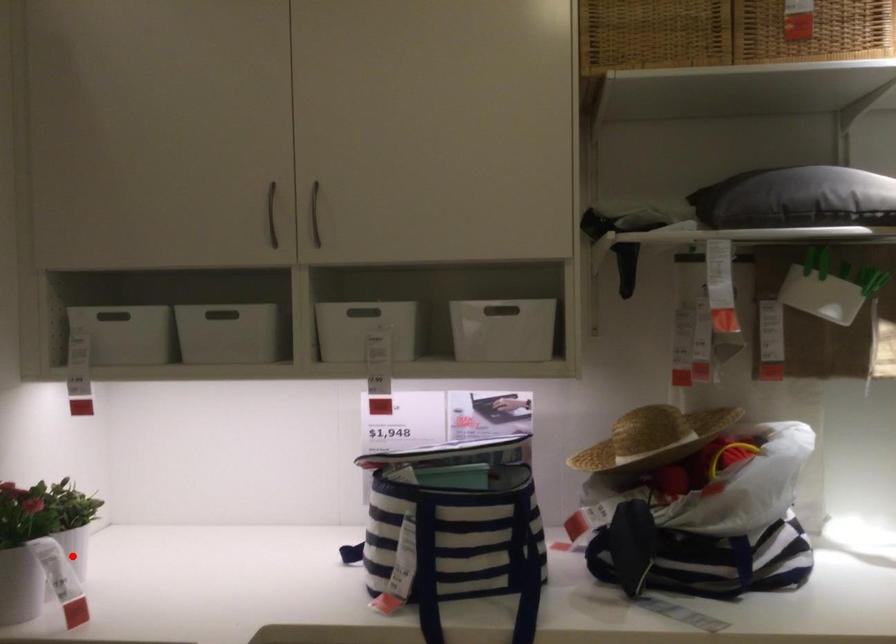
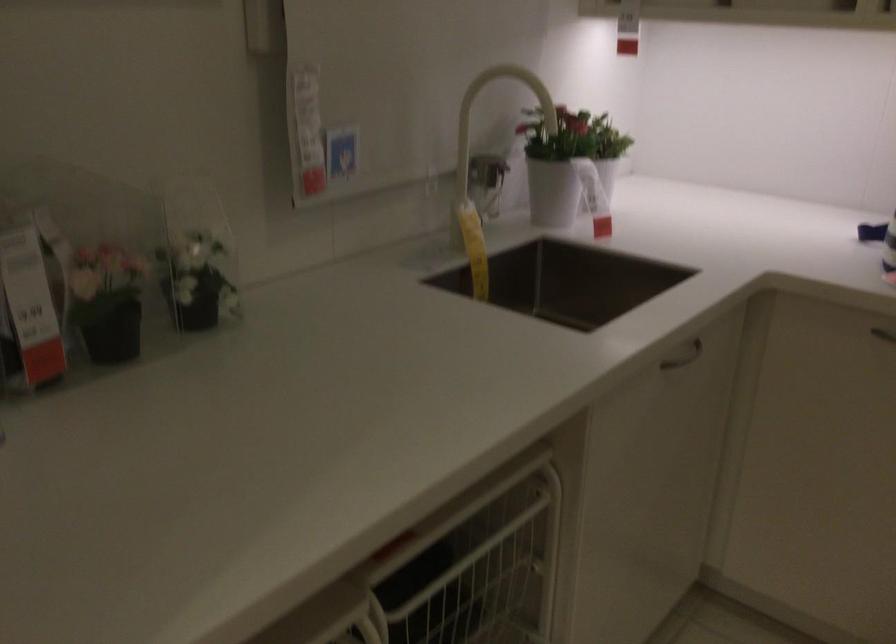
Question: A red point is marked in image1. In image2, is the corresponding 3D point closer to the camera or farther? Reply with the corresponding letter.

Choices:
 (A) The corresponding 3D point is closer.
 (B) The corresponding 3D point is farther.

Answer: (B)